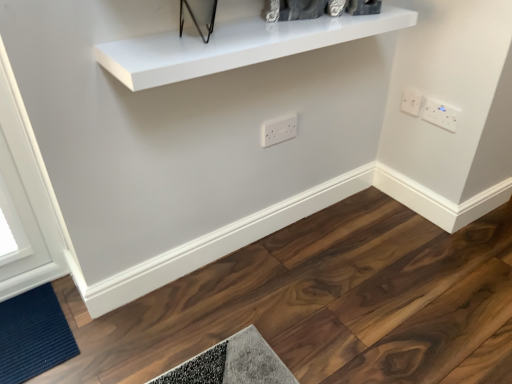
Question: Is the depth of dark blue textured mat at lower left greater than that of white plastic socket at upper right, acting as the 2th electric outlet starting from the left?

Choices:
 (A) no
 (B) yes

Answer: (A)

Question: From the image's perspective, does dark blue textured mat at lower left appear lower than white plastic socket at upper right, acting as the 2th electric outlet starting from the left?

Choices:
 (A) yes
 (B) no

Answer: (A)

Question: Does dark blue textured mat at lower left have a greater height compared to white plastic socket at upper right, acting as the 2th electric outlet starting from the left?

Choices:
 (A) no
 (B) yes

Answer: (A)

Question: Can you see dark blue textured mat at lower left touching white plastic socket at upper right, acting as the 2th electric outlet starting from the left?

Choices:
 (A) yes
 (B) no

Answer: (B)

Question: Is dark blue textured mat at lower left in front of white plastic socket at upper right, acting as the 2th electric outlet starting from the left?

Choices:
 (A) no
 (B) yes

Answer: (B)

Question: From a real-world perspective, is dark blue textured mat at lower left on top of white plastic socket at upper right, acting as the 2th electric outlet starting from the left?

Choices:
 (A) yes
 (B) no

Answer: (B)

Question: Is white plastic electric outlet at upper right, positioned as the 1th electric outlet in right-to-left order, shorter than white glossy shelf at upper center?

Choices:
 (A) no
 (B) yes

Answer: (A)

Question: Is white plastic electric outlet at upper right, which ranks as the 3th electric outlet in left-to-right order, bigger than white glossy shelf at upper center?

Choices:
 (A) no
 (B) yes

Answer: (A)

Question: From the image's perspective, would you say white plastic electric outlet at upper right, which ranks as the 3th electric outlet in left-to-right order, is shown under white glossy shelf at upper center?

Choices:
 (A) no
 (B) yes

Answer: (B)

Question: Considering the relative positions of white plastic electric outlet at upper right, positioned as the 1th electric outlet in right-to-left order, and white glossy shelf at upper center in the image provided, is white plastic electric outlet at upper right, positioned as the 1th electric outlet in right-to-left order, behind white glossy shelf at upper center?

Choices:
 (A) no
 (B) yes

Answer: (B)

Question: Is white plastic electric outlet at upper right, which ranks as the 3th electric outlet in left-to-right order, thinner than white glossy shelf at upper center?

Choices:
 (A) yes
 (B) no

Answer: (A)

Question: From a real-world perspective, is white plastic electric outlet at upper right, positioned as the 1th electric outlet in right-to-left order, under white glossy shelf at upper center?

Choices:
 (A) yes
 (B) no

Answer: (A)

Question: Is white plastic electric outlet at upper right, which ranks as the 3th electric outlet in left-to-right order, positioned with its back to white plastic outlet at center, which is the 3th electric outlet in right-to-left order?

Choices:
 (A) yes
 (B) no

Answer: (B)